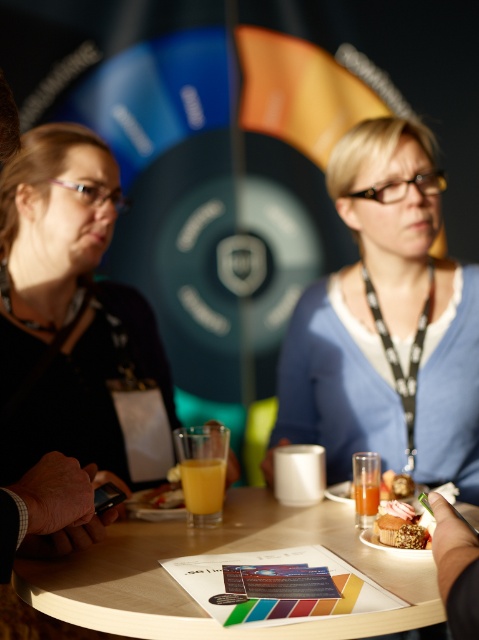
Question: Does translucent glass of orange juice at table center appear on the right side of translucent glass at table center?

Choices:
 (A) yes
 (B) no

Answer: (B)

Question: Estimate the real-world distances between objects in this image. Which object is closer to the blue fabric cardigan at center?

Choices:
 (A) golden textured muffin at lower center
 (B) translucent glass of orange juice at table center

Answer: (B)

Question: Estimate the real-world distances between objects in this image. Which object is closer to the translucent glass of orange juice at table center?

Choices:
 (A) blue fabric cardigan at center
 (B) matte black shirt at left

Answer: (B)

Question: Does matte black shirt at left have a larger size compared to wooden table at center?

Choices:
 (A) yes
 (B) no

Answer: (A)

Question: Does wooden table at center appear on the left side of translucent glass beverage at table center?

Choices:
 (A) no
 (B) yes

Answer: (B)

Question: Which of the following is the closest to the observer?

Choices:
 (A) (428, 252)
 (B) (424, 541)

Answer: (B)